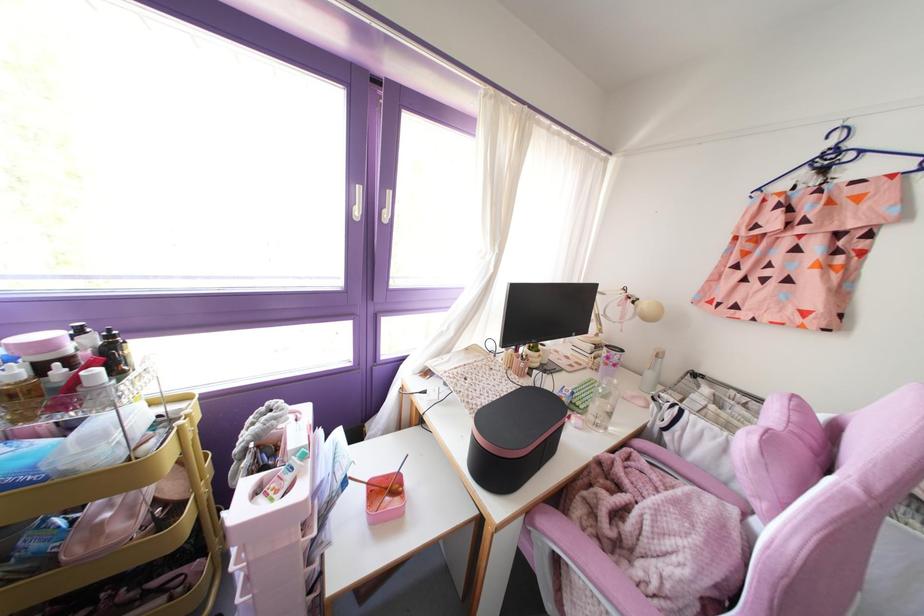
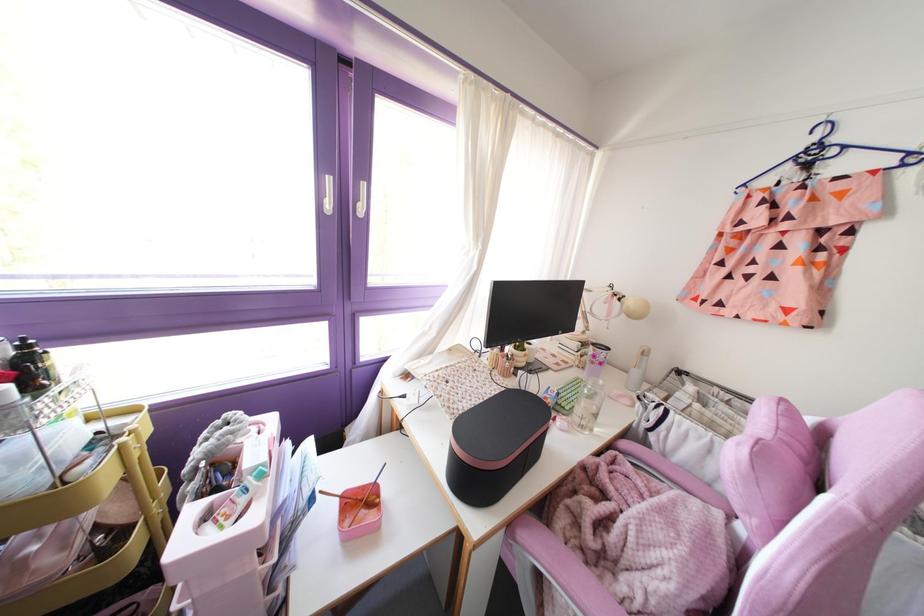
The point at (383,476) is marked in the first image. Where is the corresponding point in the second image?

(359, 487)